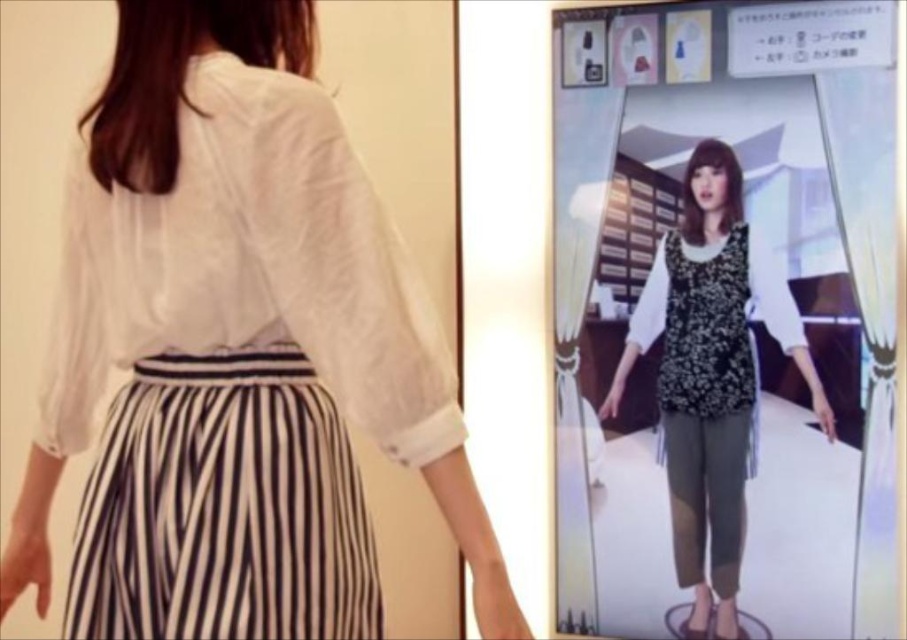
You are a photographer adjusting the camera focus. You need to focus on two points in the scene, point (307, 241) and point (704, 344). Which point should you focus on first to ensure the closest object is sharp?

Point (307, 241) is closer to the camera than point (704, 344), so you should focus on point (307, 241) first to ensure the closest object is sharp.

You are a fashion designer observing the person in the scene. You notice a specific point marked at coordinates (250, 268). Which article of clothing is this point located on?

The point at coordinates (250, 268) is located on the white sheer blouse at upper left.